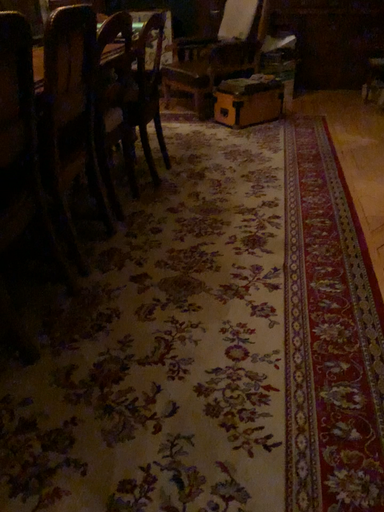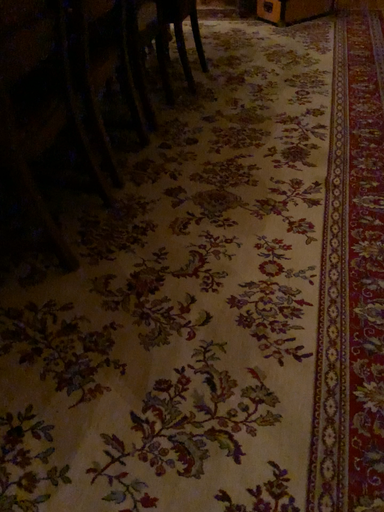
Question: How did the camera likely rotate when shooting the video?

Choices:
 (A) rotated downward
 (B) rotated upward

Answer: (A)